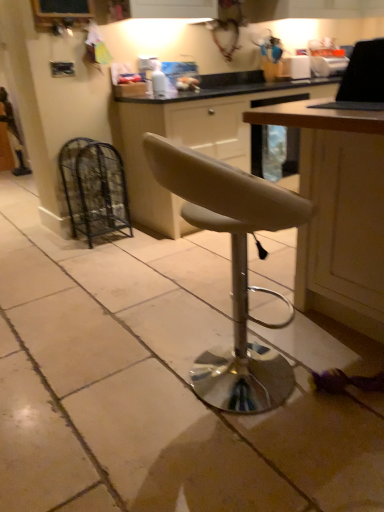
This screenshot has height=512, width=384. Find the location of `free space behind beige leather stool at center`. free space behind beige leather stool at center is located at coordinates (196, 313).